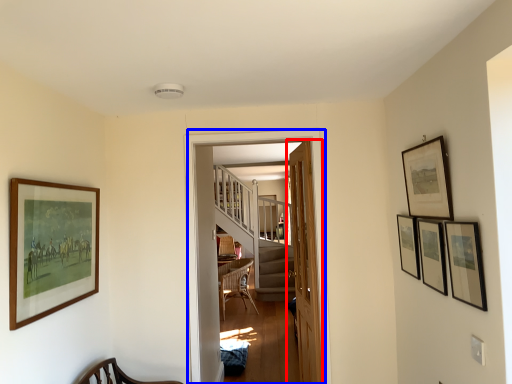
Question: Among these objects, which one is farthest to the camera, door (highlighted by a red box) or corridor (highlighted by a blue box)?

Choices:
 (A) door
 (B) corridor

Answer: (A)